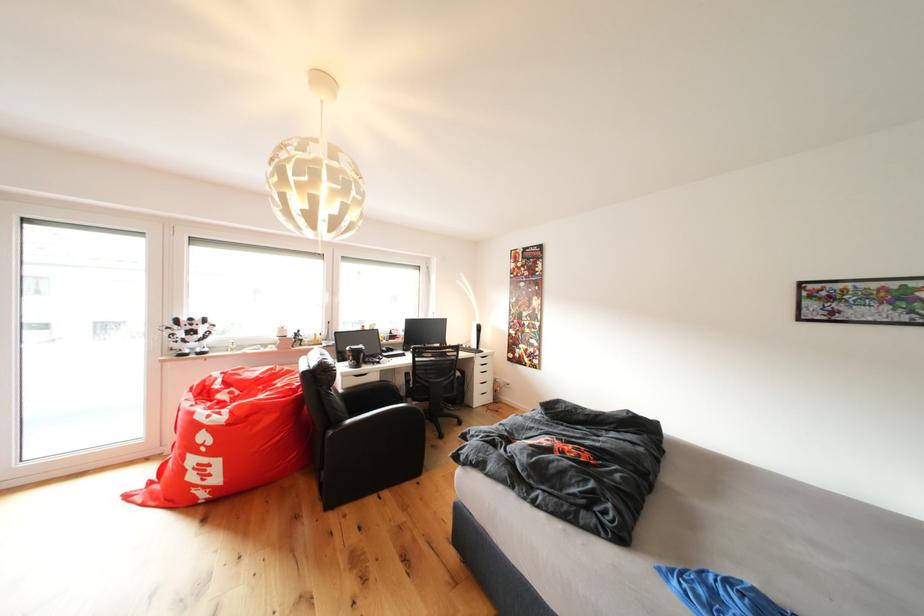
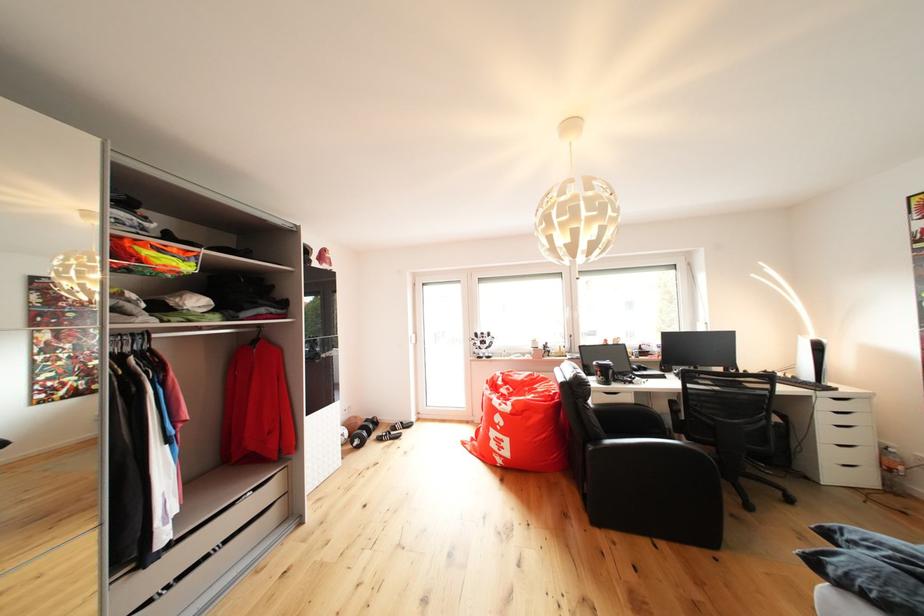
The point at (489, 399) is marked in the first image. Where is the corresponding point in the second image?

(846, 469)